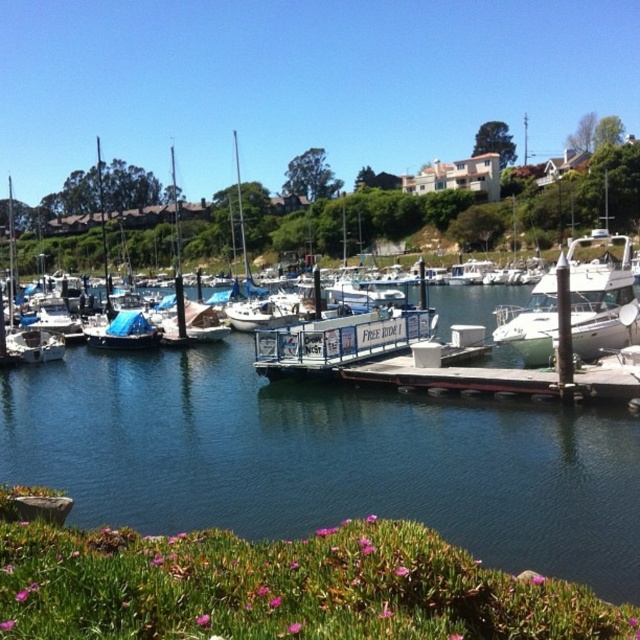
Question: Can you confirm if white matte sailboat at left is smaller than blue painted metal dock at center?

Choices:
 (A) yes
 (B) no

Answer: (B)

Question: Which is nearer to the wooden dock at center?

Choices:
 (A) clear blue water at center
 (B) white matte sailboat at left

Answer: (A)

Question: Which point is closer to the camera?

Choices:
 (A) clear blue water at center
 (B) white glossy boat at center

Answer: (A)

Question: Which object is positioned closest to the blue painted metal dock at center?

Choices:
 (A) white glossy boat at center
 (B) clear blue water at center
 (C) wooden dock at center
 (D) white matte sailboat at left

Answer: (C)

Question: Can you confirm if white glossy boat at center is smaller than blue painted metal dock at center?

Choices:
 (A) no
 (B) yes

Answer: (A)

Question: Can you confirm if white matte sailboat at left is positioned to the left of wooden dock at center?

Choices:
 (A) yes
 (B) no

Answer: (A)